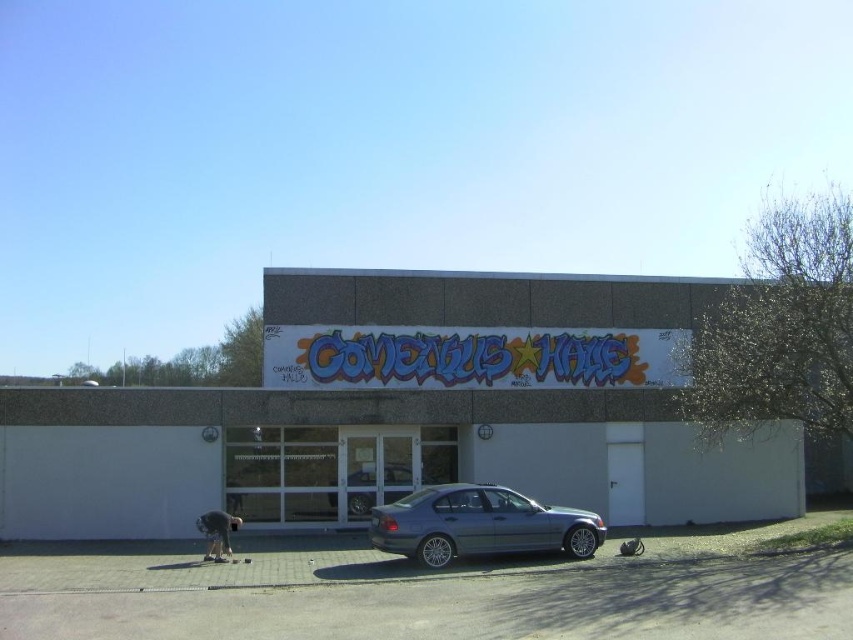
Is point (444, 556) in front of point (207, 525)?

Yes, it is in front of point (207, 525).

Describe the element at coordinates (479, 524) in the screenshot. I see `satin silver sedan at center` at that location.

Who is more forward, (485,520) or (225,544)?

Point (485,520) is more forward.

This screenshot has height=640, width=853. Identify the location of satin silver sedan at center. (479, 524).

Does concrete building at center appear on the right side of satin silver sedan at center?

Correct, you'll find concrete building at center to the right of satin silver sedan at center.

Can you confirm if concrete building at center is taller than satin silver sedan at center?

Correct, concrete building at center is much taller as satin silver sedan at center.

Is point (201, 493) farther from viewer compared to point (456, 508)?

Yes, it is behind point (456, 508).

Locate an element on the screen. Image resolution: width=853 pixels, height=640 pixels. concrete building at center is located at coordinates (403, 417).

Can you confirm if silver metallic sedan at center is wider than dark gray fabric person at lower left?

Result: Yes, silver metallic sedan at center is wider than dark gray fabric person at lower left.

Between silver metallic sedan at center and dark gray fabric person at lower left, which one has less height?

dark gray fabric person at lower left is shorter.

Is point (363, 499) closer to camera compared to point (225, 513)?

No, (363, 499) is further to viewer.

The image size is (853, 640). Find the location of `silver metallic sedan at center`. silver metallic sedan at center is located at coordinates (376, 488).